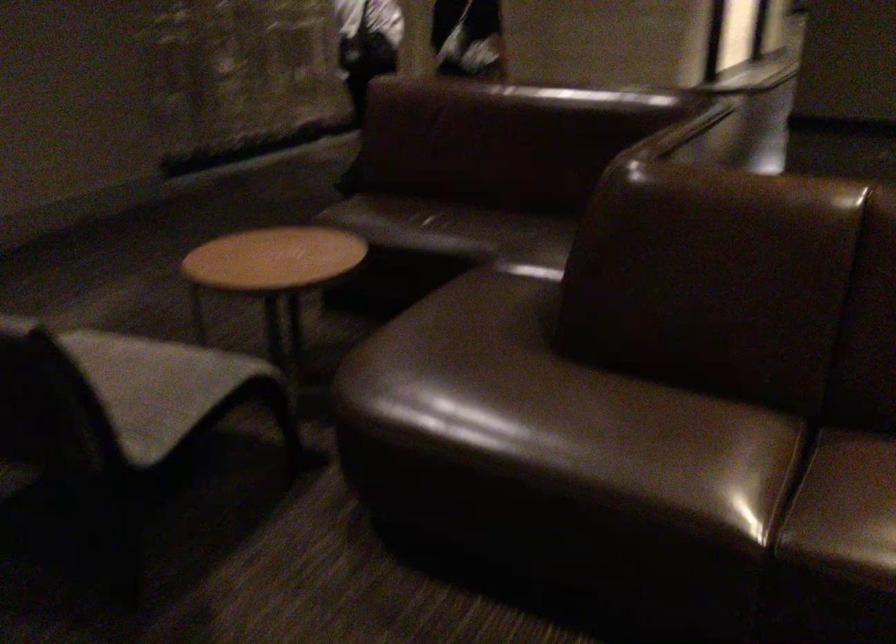
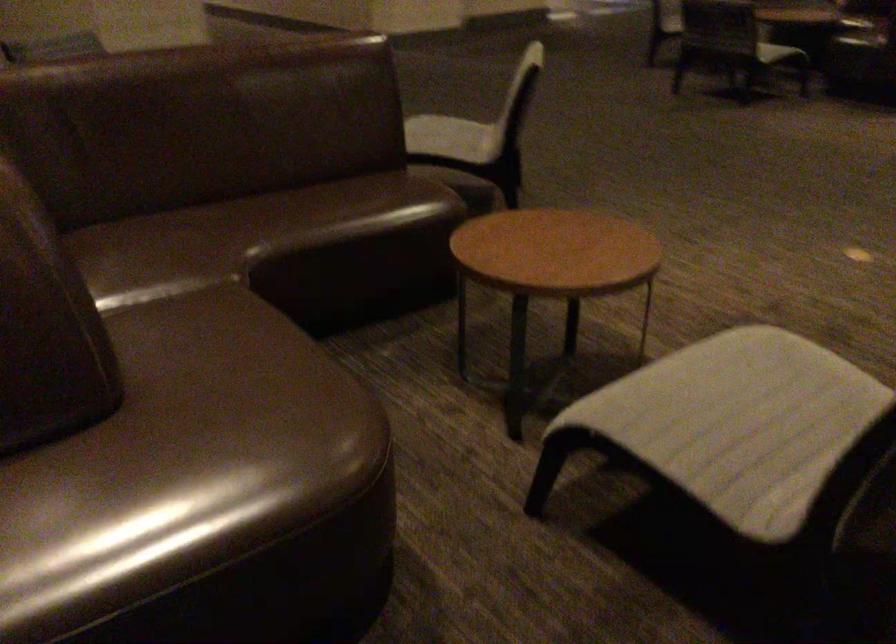
Question: The camera is either moving clockwise (left) or counter-clockwise (right) around the object. The first image is from the beginning of the video and the second image is from the end. Is the camera moving left or right when shooting the video?

Choices:
 (A) Left
 (B) Right

Answer: (A)